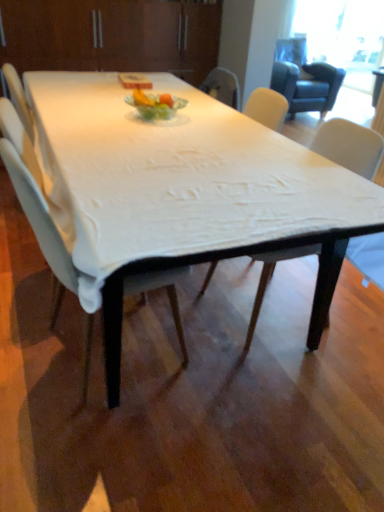
In order to face white fabric chair at center, marked as the second chair in a left-to-right arrangement, should I rotate leftwards or rightwards?

A 12.075 degree turn to the right will do.

Image resolution: width=384 pixels, height=512 pixels. Describe the element at coordinates (156, 105) in the screenshot. I see `white glass plate at center` at that location.

At what (x,y) coordinates should I click in order to perform the action: click on white fabric table at center. Please return your answer as a coordinate pair (x, y). The width and height of the screenshot is (384, 512). Looking at the image, I should click on (112, 35).

Is white fabric-covered table at center inside or outside of white fabric table at center?

white fabric-covered table at center is spatially situated outside white fabric table at center.

Which object is closer to the camera, white fabric-covered table at center or white fabric table at center?

white fabric-covered table at center.

Who is shorter, white fabric-covered table at center or white fabric table at center?

white fabric-covered table at center is shorter.

Could white glass plate at center be considered to be inside white fabric table at center?

No.

Can you confirm if white fabric table at center is smaller than white glass plate at center?

No.

Considering the sizes of objects white fabric table at center and white glass plate at center in the image provided, who is shorter, white fabric table at center or white glass plate at center?

white glass plate at center.

Considering the sizes of objects white fabric table at center and transparent glass window screen at upper right in the image provided, who is thinner, white fabric table at center or transparent glass window screen at upper right?

transparent glass window screen at upper right.

Is white fabric table at center oriented towards transparent glass window screen at upper right?

No, white fabric table at center does not turn towards transparent glass window screen at upper right.

Between white fabric table at center and transparent glass window screen at upper right, which one has larger size?

white fabric table at center is bigger.

Which object is positioned more to the left, white fabric table at center or transparent glass window screen at upper right?

white fabric table at center is more to the left.

Looking at this image, in terms of height, does white fabric-covered table at center look taller or shorter compared to white fabric chair at center, arranged as the 1th chair when viewed from the left?

Considering their sizes, white fabric-covered table at center has less height than white fabric chair at center, arranged as the 1th chair when viewed from the left.

Image resolution: width=384 pixels, height=512 pixels. In order to click on chair on the left of white fabric-covered table at center in this screenshot , I will do `click(41, 226)`.

In the image, is white fabric-covered table at center positioned in front of or behind white fabric chair at center, arranged as the 1th chair when viewed from the left?

Clearly, white fabric-covered table at center is in front of white fabric chair at center, arranged as the 1th chair when viewed from the left.

Considering the relative sizes of white fabric-covered table at center and white fabric chair at center, acting as the second chair starting from the right, in the image provided, is white fabric-covered table at center smaller than white fabric chair at center, acting as the second chair starting from the right,?

No, white fabric-covered table at center is not smaller than white fabric chair at center, acting as the second chair starting from the right.

Is white fabric chair at center, the first chair viewed from the right, facing towards white fabric chair at center, acting as the second chair starting from the right?

Yes, white fabric chair at center, the first chair viewed from the right, is facing white fabric chair at center, acting as the second chair starting from the right.

From a real-world perspective, who is located lower, white fabric chair at center, marked as the second chair in a left-to-right arrangement, or white fabric chair at center, acting as the second chair starting from the right?

In real-world perspective, white fabric chair at center, marked as the second chair in a left-to-right arrangement, is lower.

Is white fabric chair at center, the first chair viewed from the right, wider than white fabric chair at center, acting as the second chair starting from the right?

In fact, white fabric chair at center, the first chair viewed from the right, might be narrower than white fabric chair at center, acting as the second chair starting from the right.

Is point (327, 131) farther from viewer compared to point (56, 303)?

No, it is not.

Is white fabric chair at center, the first chair viewed from the right, surrounded by white fabric table at center?

No, white fabric chair at center, the first chair viewed from the right, is not a part of white fabric table at center.

Based on their sizes in the image, would you say white fabric table at center is bigger or smaller than white fabric chair at center, the first chair viewed from the right?

In the image, white fabric table at center appears to be larger than white fabric chair at center, the first chair viewed from the right.

In the scene shown: Which is more to the left, white fabric table at center or white fabric chair at center, marked as the second chair in a left-to-right arrangement?

white fabric table at center is more to the left.

From a real-world perspective, between white fabric table at center and white fabric chair at center, marked as the second chair in a left-to-right arrangement, who is vertically lower?

white fabric chair at center, marked as the second chair in a left-to-right arrangement, is physically lower.

From the image's perspective, is white fabric chair at center, the first chair viewed from the right, positioned above or below white fabric-covered table at center?

From the image's perspective, white fabric chair at center, the first chair viewed from the right, appears below white fabric-covered table at center.

How many degrees apart are the facing directions of white fabric chair at center, marked as the second chair in a left-to-right arrangement, and white fabric-covered table at center?

white fabric chair at center, marked as the second chair in a left-to-right arrangement, and white fabric-covered table at center are facing 179 degrees away from each other.

Consider the image. Considering the sizes of objects white fabric chair at center, marked as the second chair in a left-to-right arrangement, and white fabric-covered table at center in the image provided, who is shorter, white fabric chair at center, marked as the second chair in a left-to-right arrangement, or white fabric-covered table at center?

With less height is white fabric-covered table at center.

From a real-world perspective, between white fabric chair at center, marked as the second chair in a left-to-right arrangement, and white fabric-covered table at center, who is vertically lower?

white fabric chair at center, marked as the second chair in a left-to-right arrangement.

Find the location of a particular element. dresser located above the white fabric-covered table at center (from a real-world perspective) is located at coordinates (112, 35).

This screenshot has height=512, width=384. In order to click on plate to the right of white fabric table at center in this screenshot , I will do `click(156, 105)`.

When comparing their distances from white fabric-covered table at center, does white fabric chair at center, arranged as the 1th chair when viewed from the left, or transparent glass window screen at upper right seem further?

Among the two, transparent glass window screen at upper right is located further to white fabric-covered table at center.

Which object lies further to the anchor point white glass plate at center, transparent glass window screen at upper right or white fabric-covered table at center?

Among the two, transparent glass window screen at upper right is located further to white glass plate at center.

Looking at the image, which one is located closer to white fabric chair at center, the first chair viewed from the right, transparent glass window screen at upper right or white fabric chair at center, arranged as the 1th chair when viewed from the left?

The object closer to white fabric chair at center, the first chair viewed from the right, is white fabric chair at center, arranged as the 1th chair when viewed from the left.

Considering their positions, is white fabric chair at center, acting as the second chair starting from the right, positioned further to transparent glass window screen at upper right than white fabric chair at center, the first chair viewed from the right?

Based on the image, white fabric chair at center, acting as the second chair starting from the right, appears to be further to transparent glass window screen at upper right.

Estimate the real-world distances between objects in this image. Which object is closer to transparent glass window screen at upper right, white fabric-covered table at center or white glass plate at center?

white glass plate at center.

In the scene shown: Based on their spatial positions, is white fabric chair at center, marked as the second chair in a left-to-right arrangement, or white fabric chair at center, arranged as the 1th chair when viewed from the left, further from white glass plate at center?

white fabric chair at center, marked as the second chair in a left-to-right arrangement.

From the image, which object appears to be farther from white fabric chair at center, acting as the second chair starting from the right, white fabric chair at center, the first chair viewed from the right, or white glass plate at center?

white glass plate at center.

Which object lies nearer to the anchor point white fabric chair at center, arranged as the 1th chair when viewed from the left, white fabric table at center or white fabric chair at center, marked as the second chair in a left-to-right arrangement?

white fabric chair at center, marked as the second chair in a left-to-right arrangement, is closer to white fabric chair at center, arranged as the 1th chair when viewed from the left.

Where is `dresser located between white fabric chair at center, marked as the second chair in a left-to-right arrangement, and transparent glass window screen at upper right in the depth direction`? dresser located between white fabric chair at center, marked as the second chair in a left-to-right arrangement, and transparent glass window screen at upper right in the depth direction is located at coordinates (112, 35).

At what (x,y) coordinates should I click in order to perform the action: click on plate between white fabric chair at center, marked as the second chair in a left-to-right arrangement, and white fabric table at center, along the z-axis. Please return your answer as a coordinate pair (x, y). Image resolution: width=384 pixels, height=512 pixels. Looking at the image, I should click on (156, 105).

Where is `plate positioned between white fabric chair at center, marked as the second chair in a left-to-right arrangement, and transparent glass window screen at upper right from near to far`? This screenshot has width=384, height=512. plate positioned between white fabric chair at center, marked as the second chair in a left-to-right arrangement, and transparent glass window screen at upper right from near to far is located at coordinates (156, 105).

At what (x,y) coordinates should I click in order to perform the action: click on dresser between white fabric chair at center, acting as the second chair starting from the right, and transparent glass window screen at upper right in the front-back direction. Please return your answer as a coordinate pair (x, y). Looking at the image, I should click on (112, 35).